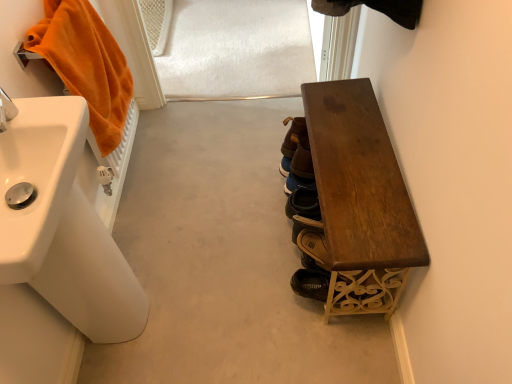
Where is `unoccupied region to the right of white glossy sink at left, which appears as the first sink when viewed from the back`? unoccupied region to the right of white glossy sink at left, which appears as the first sink when viewed from the back is located at coordinates (178, 304).